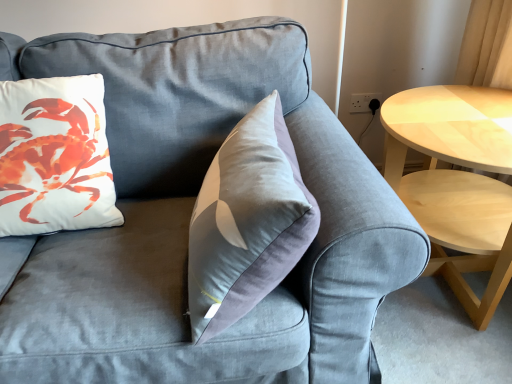
Describe the element at coordinates (54, 157) in the screenshot. I see `white matte pillow at upper left` at that location.

The image size is (512, 384). I want to click on white matte pillow at upper left, so click(x=54, y=157).

Describe the element at coordinates (456, 179) in the screenshot. I see `light wood/woodenobject at right` at that location.

Find the location of a particular element. The height and width of the screenshot is (384, 512). light wood/woodenobject at right is located at coordinates (456, 179).

What is the approximate width of light wood/woodenobject at right?

light wood/woodenobject at right is 24.09 inches in width.

What are the coordinates of `white matte pillow at upper left` in the screenshot? It's located at (54, 157).

Consider the image. Which is more to the left, light wood/woodenobject at right or white matte pillow at upper left?

From the viewer's perspective, white matte pillow at upper left appears more on the left side.

Which is in front, light wood/woodenobject at right or white matte pillow at upper left?

Positioned in front is white matte pillow at upper left.

Which is closer, [470,144] or [33,168]?

The point [33,168] is more forward.

From the image's perspective, is light wood/woodenobject at right over white matte pillow at upper left?

Incorrect, from the image's perspective, light wood/woodenobject at right is lower than white matte pillow at upper left.

From a real-world perspective, which object rests below the other?

From a 3D spatial view, light wood/woodenobject at right is below.

Does light wood/woodenobject at right have a greater width compared to white matte pillow at upper left?

Correct, the width of light wood/woodenobject at right exceeds that of white matte pillow at upper left.

Can you confirm if light wood/woodenobject at right is taller than white matte pillow at upper left?

No.

Is light wood/woodenobject at right bigger or smaller than white matte pillow at upper left?

Clearly, light wood/woodenobject at right is larger in size than white matte pillow at upper left.

Does light wood/woodenobject at right contain white matte pillow at upper left?

No, white matte pillow at upper left is not surrounded by light wood/woodenobject at right.

Is light wood/woodenobject at right positioned far away from white matte pillow at upper left?

No, light wood/woodenobject at right is in close proximity to white matte pillow at upper left.

Based on the photo, is light wood/woodenobject at right oriented away from white matte pillow at upper left?

No, white matte pillow at upper left is not at the back of light wood/woodenobject at right.

How many degrees apart are the facing directions of light wood/woodenobject at right and white matte pillow at upper left?

1.94 degrees separate the facing orientations of light wood/woodenobject at right and white matte pillow at upper left.

At what (x,y) coordinates should I click in order to perform the action: click on pillow located above the light wood/woodenobject at right (from a real-world perspective). Please return your answer as a coordinate pair (x, y). The width and height of the screenshot is (512, 384). Looking at the image, I should click on (54, 157).

Considering the positions of objects white matte pillow at upper left and light wood/woodenobject at right in the image provided, who is more to the right, white matte pillow at upper left or light wood/woodenobject at right?

light wood/woodenobject at right.

Which object is further away from the camera, white matte pillow at upper left or light wood/woodenobject at right?

light wood/woodenobject at right is further from the camera.

Does point (77, 159) lie behind point (449, 98)?

No, it is not.

From the image's perspective, does white matte pillow at upper left appear lower than light wood/woodenobject at right?

No, from the image's perspective, white matte pillow at upper left is not beneath light wood/woodenobject at right.

In the scene shown: From a real-world perspective, is white matte pillow at upper left located higher than light wood/woodenobject at right?

Yes, from a real-world perspective, white matte pillow at upper left is above light wood/woodenobject at right.

Can you confirm if white matte pillow at upper left is thinner than light wood/woodenobject at right?

Yes, white matte pillow at upper left is thinner than light wood/woodenobject at right.

Considering the relative sizes of white matte pillow at upper left and light wood/woodenobject at right in the image provided, is white matte pillow at upper left shorter than light wood/woodenobject at right?

In fact, white matte pillow at upper left may be taller than light wood/woodenobject at right.

Which of these two, white matte pillow at upper left or light wood/woodenobject at right, is bigger?

Bigger between the two is light wood/woodenobject at right.

Would you say white matte pillow at upper left contains light wood/woodenobject at right?

Definitely not — light wood/woodenobject at right is not inside white matte pillow at upper left.

Is white matte pillow at upper left far away from light wood/woodenobject at right?

white matte pillow at upper left is near light wood/woodenobject at right, not far away.

Is white matte pillow at upper left oriented away from light wood/woodenobject at right?

No, white matte pillow at upper left is not facing the opposite direction of light wood/woodenobject at right.

Can you tell me how much white matte pillow at upper left and light wood/woodenobject at right differ in facing direction?

They differ by 1.94 degrees in their facing directions.

This screenshot has width=512, height=384. I want to click on pillow in front of the light wood/woodenobject at right, so click(x=54, y=157).

The image size is (512, 384). Find the location of `coffee table behind the white matte pillow at upper left`. coffee table behind the white matte pillow at upper left is located at coordinates (456, 179).

At what (x,y) coordinates should I click in order to perform the action: click on coffee table that is under the white matte pillow at upper left (from a real-world perspective). Please return your answer as a coordinate pair (x, y). Image resolution: width=512 pixels, height=384 pixels. Looking at the image, I should click on (456, 179).